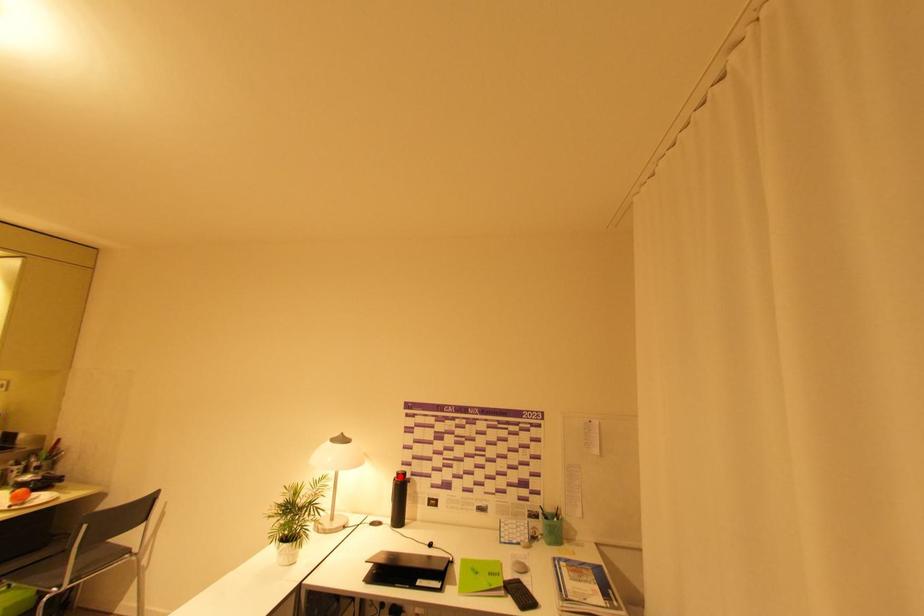
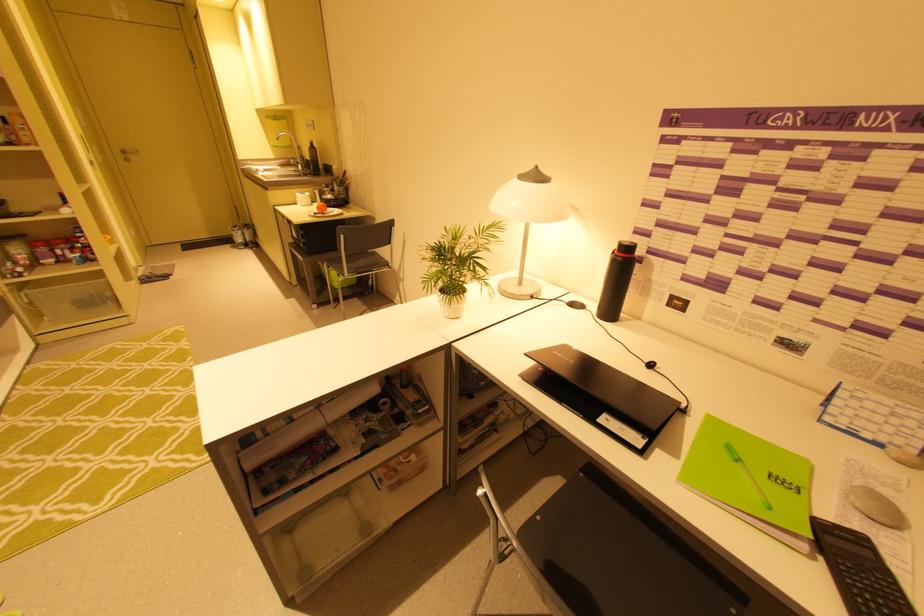
The point at the highlighted location is marked in the first image. Where is the corresponding point in the second image?

(619, 248)